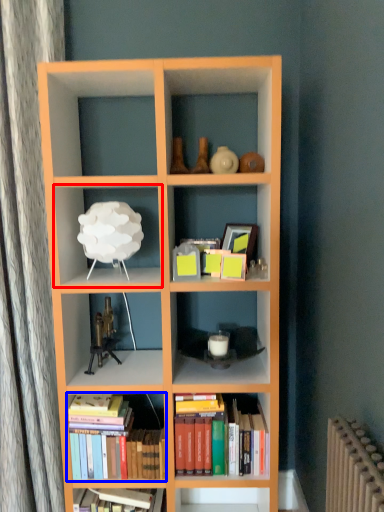
Question: Among these objects, which one is nearest to the camera, shelf (highlighted by a red box) or book (highlighted by a blue box)?

Choices:
 (A) shelf
 (B) book

Answer: (A)